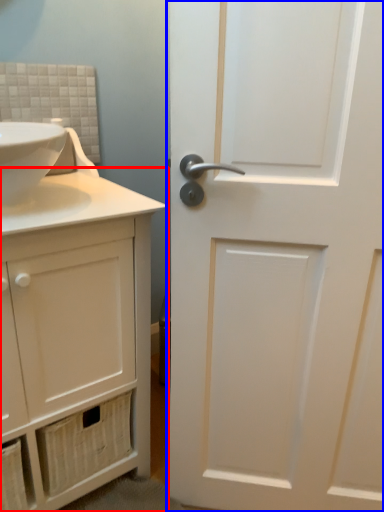
Question: Which point is closer to the camera, bathroom cabinet (highlighted by a red box) or door (highlighted by a blue box)?

Choices:
 (A) bathroom cabinet
 (B) door

Answer: (B)